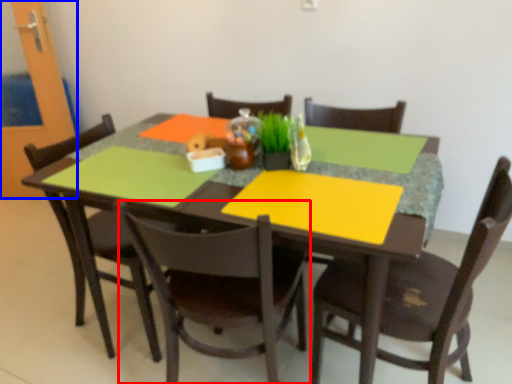
Question: Which object is closer to the camera taking this photo, chair (highlighted by a red box) or glass door (highlighted by a blue box)?

Choices:
 (A) chair
 (B) glass door

Answer: (A)